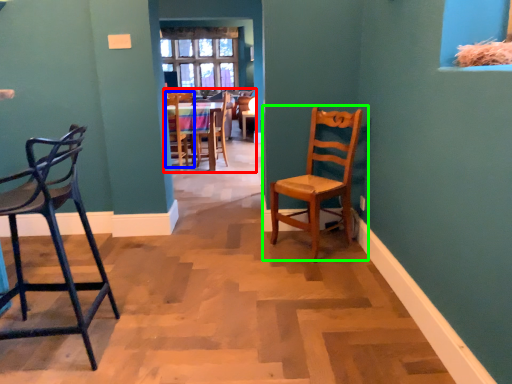
Question: Estimate the real-world distances between objects in this image. Which object is farther from chair (highlighted by a red box), chair (highlighted by a blue box) or chair (highlighted by a green box)?

Choices:
 (A) chair
 (B) chair

Answer: (B)